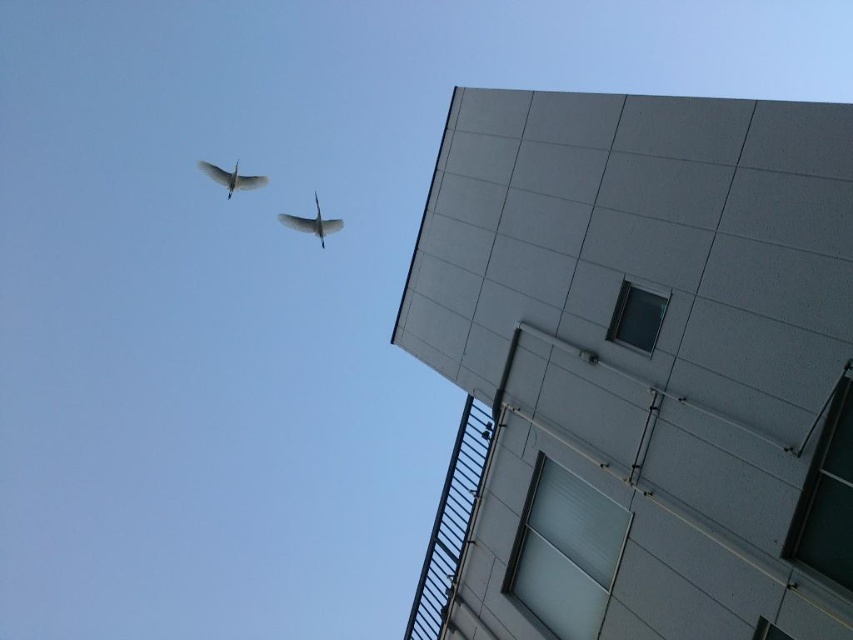
You are an ornithologist observing two birds in the sky. You notice the white matte bird at upper left and the white glossy bird at upper center. Which bird has a greater wingspan based on their sizes in the image?

The white matte bird at upper left has a greater wingspan because its width is larger than the white glossy bird at upper center.